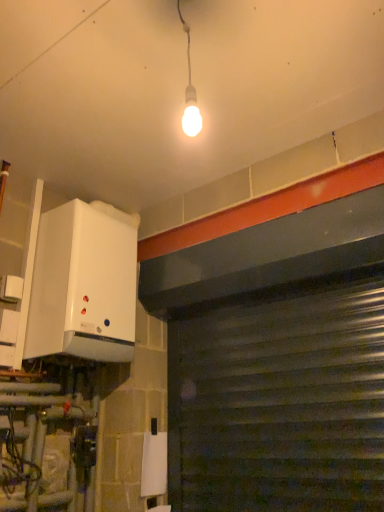
Question: From a real-world perspective, relative to white matte boiler at left, is metallic gray garage door at lower right vertically above or below?

Choices:
 (A) below
 (B) above

Answer: (A)

Question: Does point pyautogui.click(x=193, y=467) appear closer or farther from the camera than point pyautogui.click(x=112, y=206)?

Choices:
 (A) closer
 (B) farther

Answer: (A)

Question: Considering the positions of metallic gray garage door at lower right and white matte boiler at left in the image, is metallic gray garage door at lower right wider or thinner than white matte boiler at left?

Choices:
 (A) wide
 (B) thin

Answer: (B)

Question: Based on their sizes in the image, would you say white matte boiler at left is bigger or smaller than metallic gray garage door at lower right?

Choices:
 (A) small
 (B) big

Answer: (B)

Question: Is white matte boiler at left inside or outside of metallic gray garage door at lower right?

Choices:
 (A) inside
 (B) outside

Answer: (B)

Question: From their relative heights in the image, would you say white matte boiler at left is taller or shorter than metallic gray garage door at lower right?

Choices:
 (A) tall
 (B) short

Answer: (B)

Question: From the image's perspective, is white matte boiler at left located above or below metallic gray garage door at lower right?

Choices:
 (A) above
 (B) below

Answer: (A)